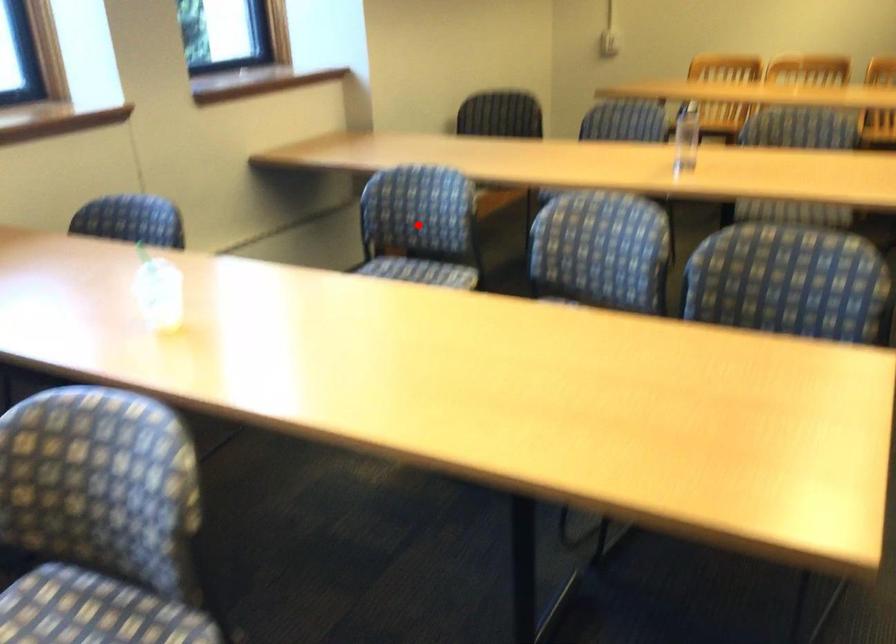
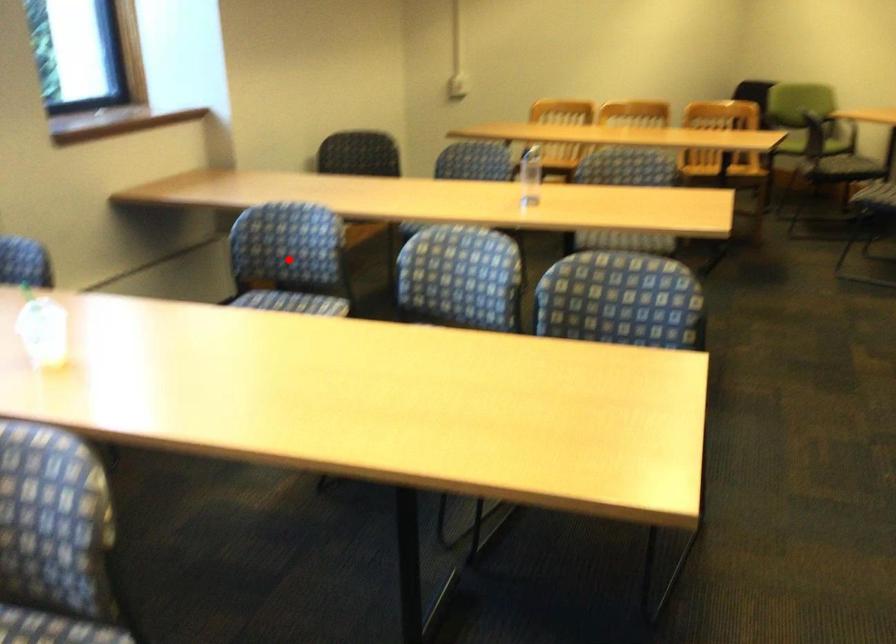
I am providing you with two images of the same scene from different viewpoints. A red point is marked on the first image and another point is marked on the second image. Do the highlighted points in image1 and image2 indicate the same real-world spot?

Yes